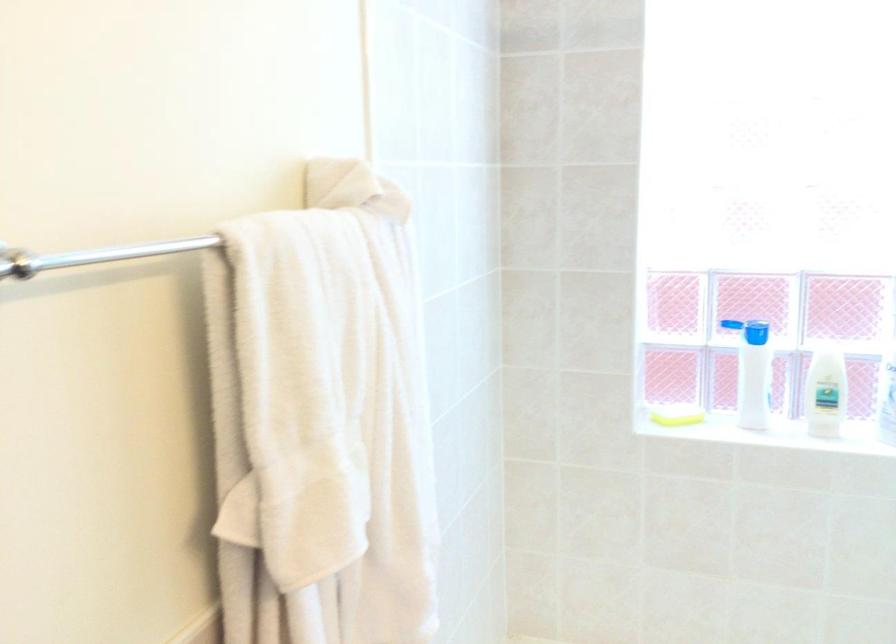
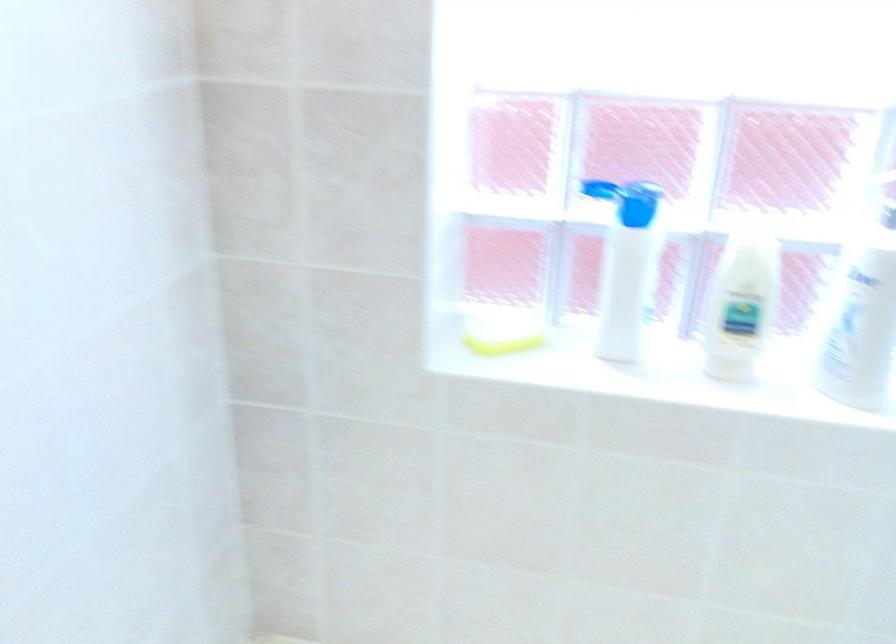
In the second image, find the point that corresponds to (x=759, y=330) in the first image.

(636, 203)